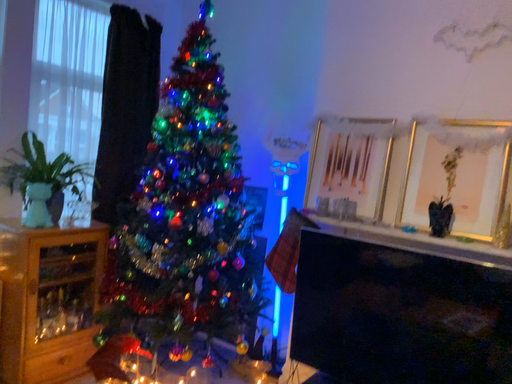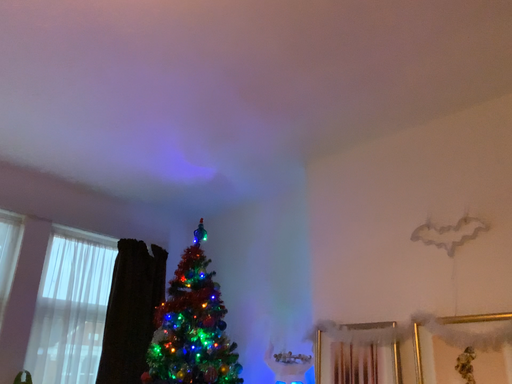
Question: Which way did the camera rotate in the video?

Choices:
 (A) rotated downward
 (B) rotated upward

Answer: (B)